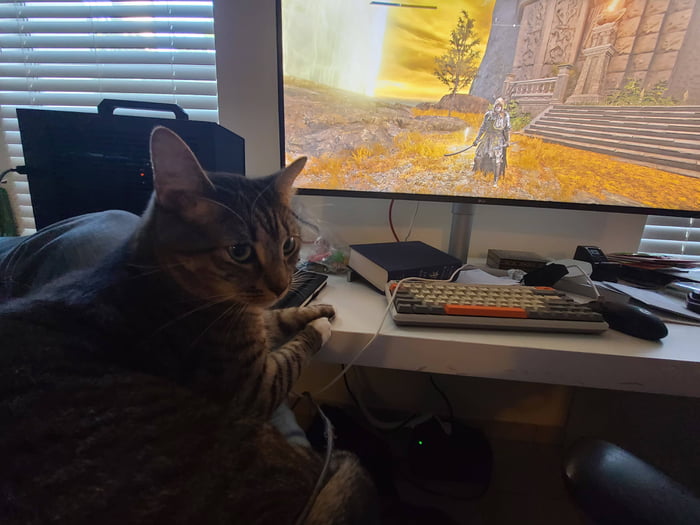
Find the location of `computer monitor`. computer monitor is located at coordinates (462, 83).